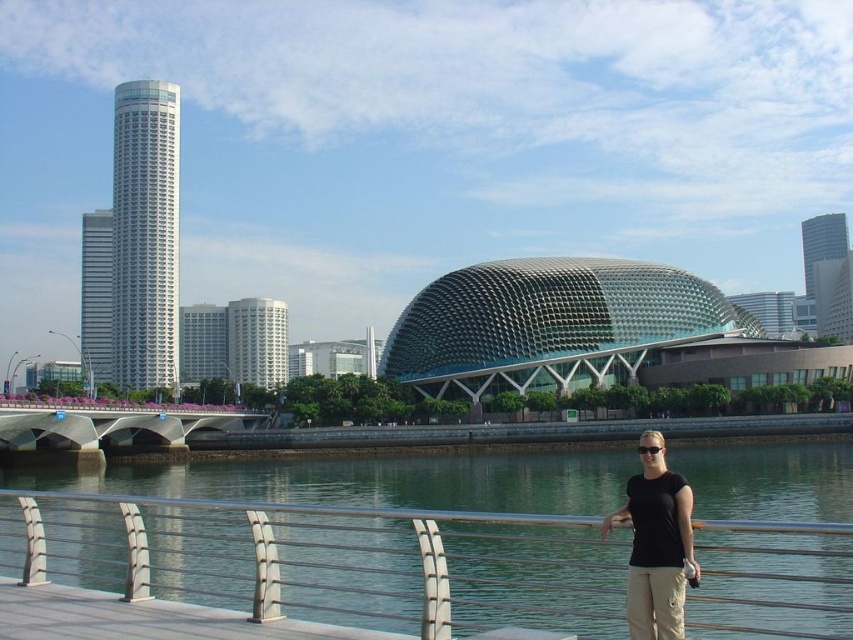
Question: Which point is farther from the camera taking this photo?

Choices:
 (A) (368, 474)
 (B) (643, 563)
 (C) (76, 432)

Answer: (A)

Question: Is greenish-blue water at lower center positioned in front of concrete bridge at center?

Choices:
 (A) yes
 (B) no

Answer: (A)

Question: Can you confirm if greenish-blue water at lower center is positioned above black matte shirt at lower center?

Choices:
 (A) no
 (B) yes

Answer: (A)

Question: Which point is farther to the camera?

Choices:
 (A) (634, 544)
 (B) (15, 429)
 (C) (519, 476)

Answer: (C)

Question: Which of the following is the farthest from the observer?

Choices:
 (A) black matte shirt at lower center
 (B) greenish-blue water at lower center
 (C) concrete bridge at center

Answer: (C)

Question: Can you confirm if black matte shirt at lower center is smaller than concrete bridge at center?

Choices:
 (A) no
 (B) yes

Answer: (A)